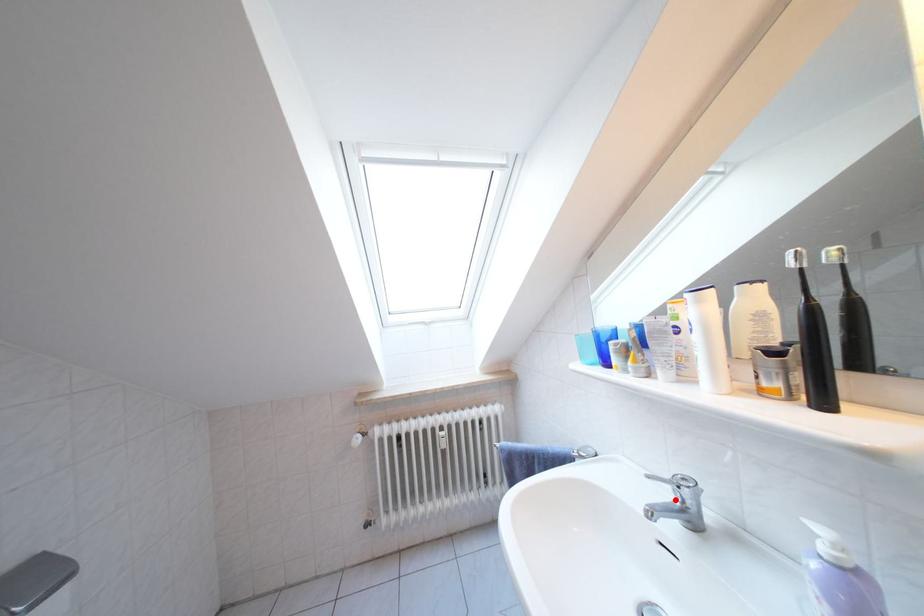
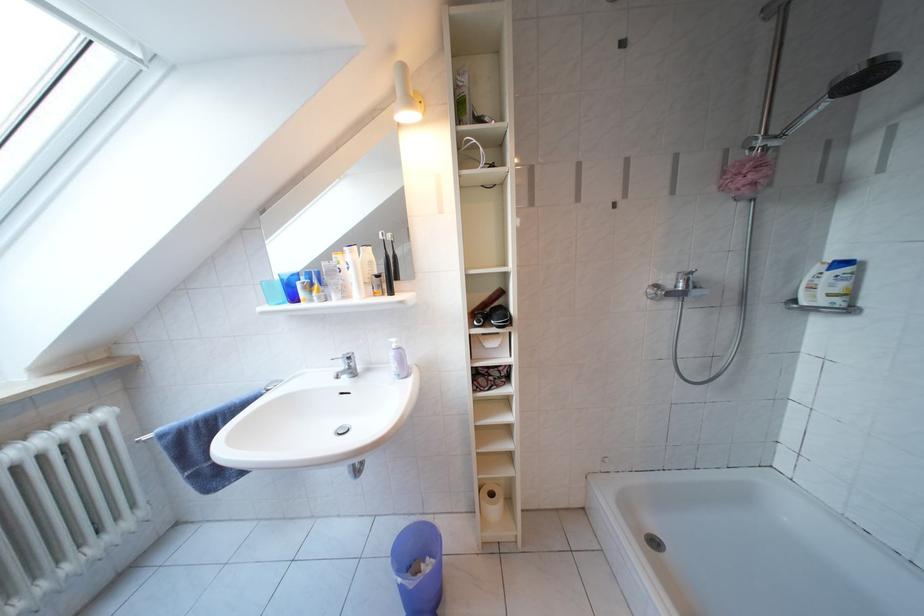
Find the pixel in the second image that matches the highlighted location in the first image.

(349, 371)